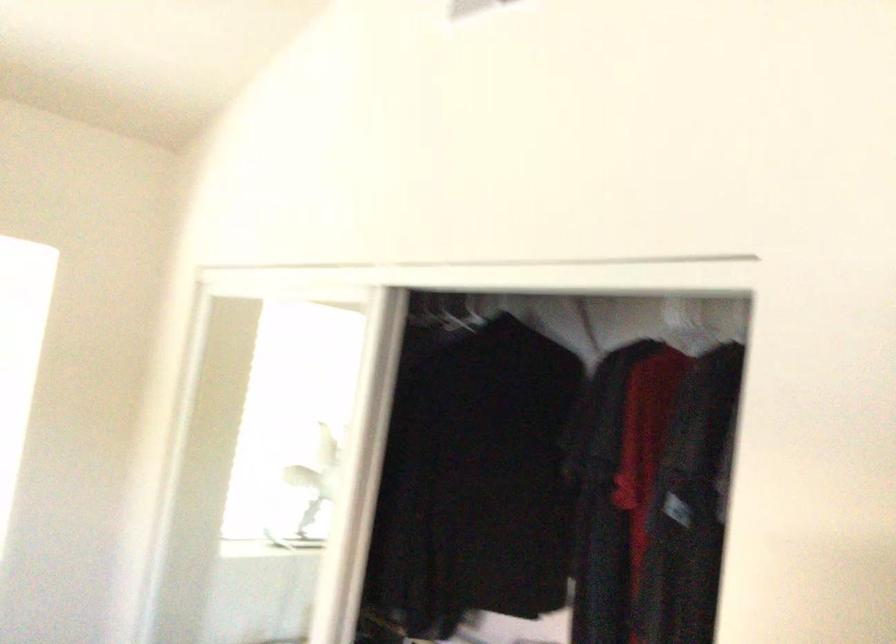
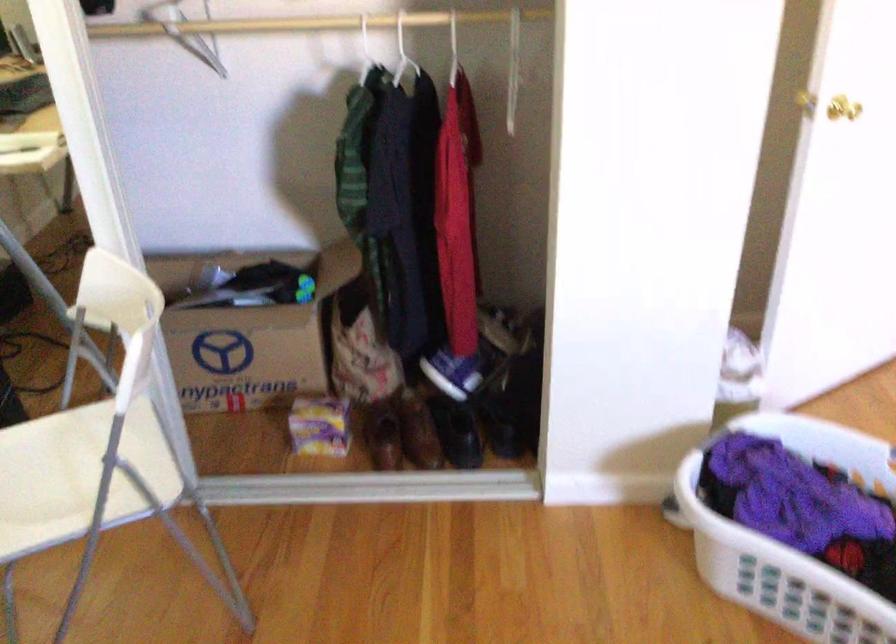
Based on the continuous images, in which direction is the camera rotating?

The camera rotated toward right-down.